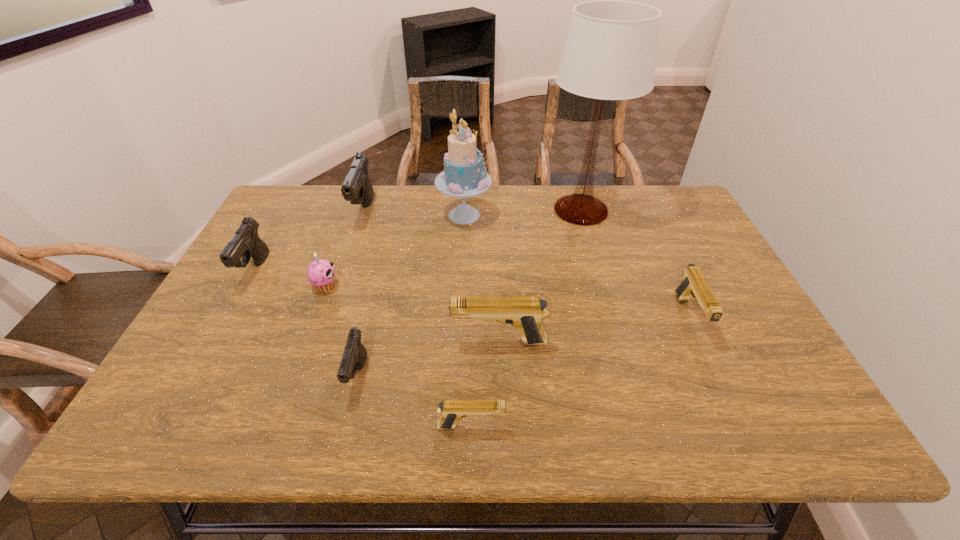
Select which black pistol appears as the closest to the tallest pistol. Please provide its 2D coordinates. Your answer should be formatted as a tuple, i.e. [(x, y)], where the tuple contains the x and y coordinates of a point satisfying the conditions above.

[(246, 243)]

Select which tan pistol appears as the second closest to the second smallest tan pistol. Please provide its 2D coordinates. Your answer should be formatted as a tuple, i.e. [(x, y)], where the tuple contains the x and y coordinates of a point satisfying the conditions above.

[(451, 411)]

Locate an element on the screen. The image size is (960, 540). the second closest tan pistol relative to the farthest pistol is located at coordinates (451, 411).

Locate an element on the screen. free space in the image that satisfies the following two spatial constraints: 1. at the barrel of the biggest tan pistol; 2. at the barrel of the rightmost black pistol is located at coordinates pyautogui.click(x=500, y=375).

Locate an element on the screen. free space that satisfies the following two spatial constraints: 1. at the barrel of the tallest pistol; 2. on the face of the cupcake is located at coordinates (340, 286).